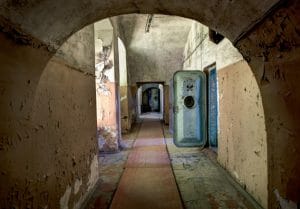
At what (x,y) coordinates should I click in order to perform the action: click on floor. Please return your answer as a coordinate pair (x, y). Looking at the image, I should click on click(x=197, y=178).